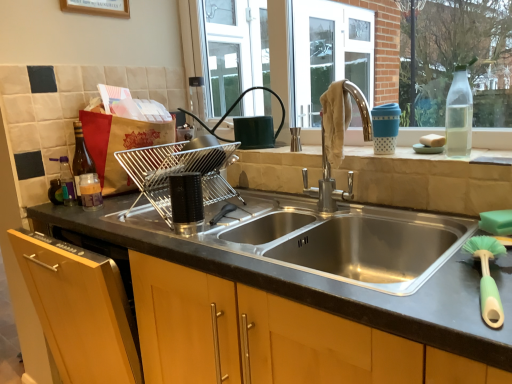
Question: Is matte glass bottle at left, the 2th bottle in the left-to-right sequence, bigger or smaller than stainless steel sink at center?

Choices:
 (A) big
 (B) small

Answer: (B)

Question: In the image, is matte glass bottle at left, the 3th bottle positioned from the front, positioned in front of or behind stainless steel sink at center?

Choices:
 (A) front
 (B) behind

Answer: (B)

Question: Which object is the farthest from the stainless steel sink at center?

Choices:
 (A) translucent plastic bottle at left, the 1th bottle positioned from the left
 (B) green plastic brush at lower right
 (C) black plastic dish rack at center, arranged as the first appliance when viewed from the front
 (D) chrome metallic faucet at upper center
 (E) transparent glass bottle at upper right, which is the 4th bottle in back-to-front order

Answer: (A)

Question: Which is farther from the white sponge at right?

Choices:
 (A) stainless steel sink at center
 (B) translucent plastic bottle at left, which is the second bottle in right-to-left order
 (C) metallic silver dish rack at sink, the 2th appliance positioned from the front
 (D) chrome metallic faucet at upper center
 (E) transparent glass bottle at upper right, positioned as the fourth bottle in left-to-right order

Answer: (B)